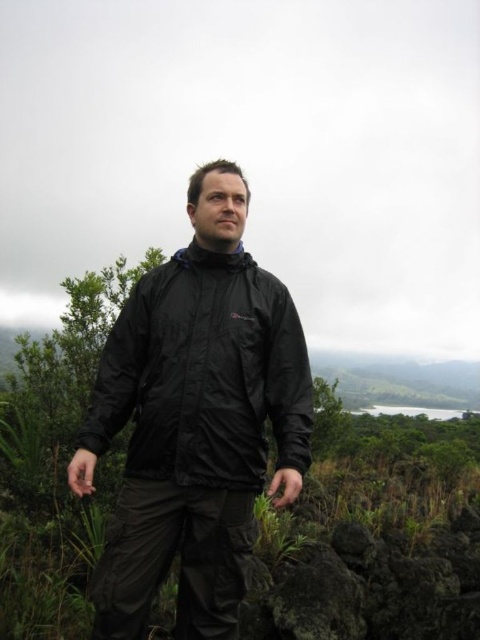
Question: Estimate the real-world distances between objects in this image. Which object is closer to the green matte plant at center?

Choices:
 (A) dark gray rough rock at lower center
 (B) black waterproof jacket at center

Answer: (B)

Question: Considering the real-world distances, which object is farthest from the dark gray rough rock at lower center?

Choices:
 (A) black waterproof jacket at center
 (B) green matte plant at center

Answer: (B)

Question: Is green matte plant at center bigger than black waterproof jacket at center?

Choices:
 (A) no
 (B) yes

Answer: (B)

Question: Which of these objects is positioned farthest from the green matte plant at center?

Choices:
 (A) black waterproof jacket at center
 (B) dark gray rough rock at lower center

Answer: (B)

Question: Can you confirm if green matte plant at center is bigger than black waterproof jacket at center?

Choices:
 (A) yes
 (B) no

Answer: (A)

Question: From the image, what is the correct spatial relationship of black waterproof jacket at center in relation to dark gray rough rock at lower center?

Choices:
 (A) below
 (B) above

Answer: (B)